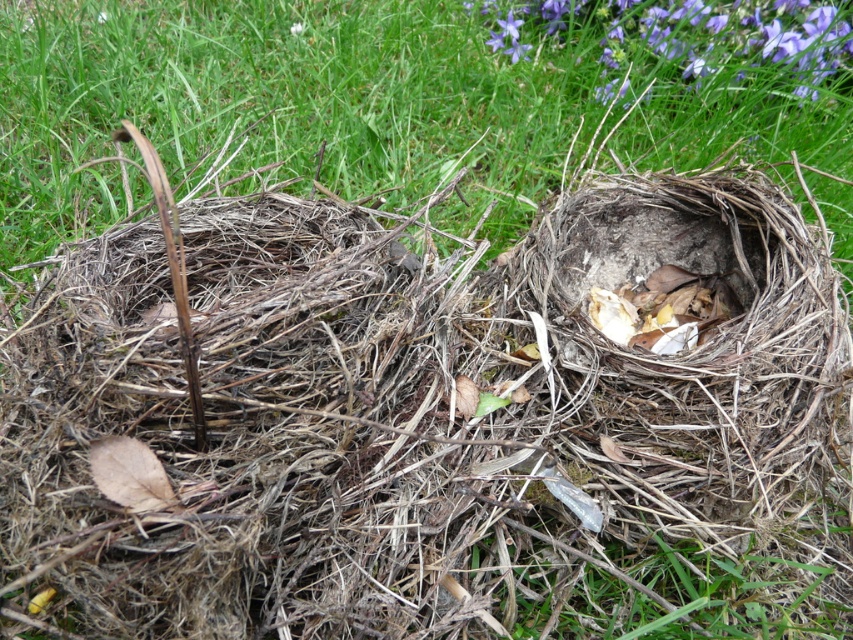
Question: Where is green dry grass at center located in relation to purple matte flower at upper right in the image?

Choices:
 (A) above
 (B) below

Answer: (B)

Question: Does green dry grass at center appear on the left side of purple matte flower at upper right?

Choices:
 (A) yes
 (B) no

Answer: (A)

Question: Is green dry grass at center smaller than purple matte flower at upper right?

Choices:
 (A) no
 (B) yes

Answer: (A)

Question: Which object appears closest to the camera in this image?

Choices:
 (A) purple matte flower at upper right
 (B) green dry grass at center

Answer: (B)

Question: Which point is closer to the camera taking this photo?

Choices:
 (A) (796, 35)
 (B) (851, 195)

Answer: (B)

Question: Which point appears closest to the camera in this image?

Choices:
 (A) (502, 35)
 (B) (114, 32)

Answer: (B)